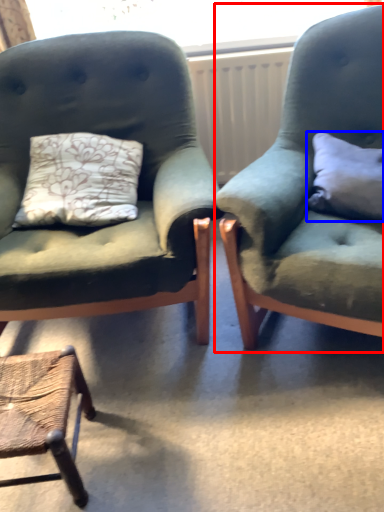
Question: Which object appears farthest to the camera in this image, chair (highlighted by a red box) or pillow (highlighted by a blue box)?

Choices:
 (A) chair
 (B) pillow

Answer: (B)